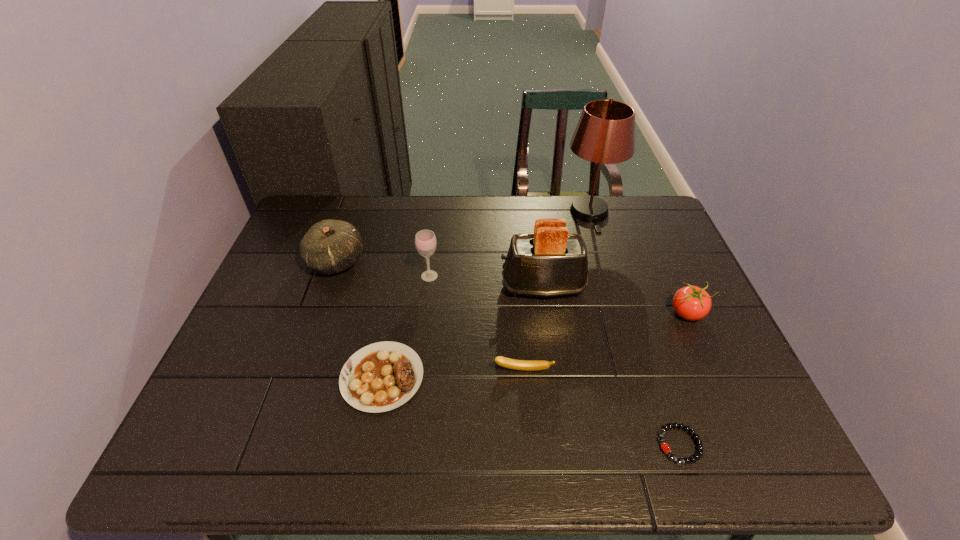
Identify the location of bracelet. (665, 447).

Find the location of `free region located on the front-facing side of the lampshade`. free region located on the front-facing side of the lampshade is located at coordinates (617, 306).

The image size is (960, 540). Find the location of `free space located on the side of the toaster with the control lever`. free space located on the side of the toaster with the control lever is located at coordinates (449, 287).

Locate an element on the screen. Image resolution: width=960 pixels, height=540 pixels. free location located 0.130m on the side of the toaster with the control lever is located at coordinates (452, 287).

The width and height of the screenshot is (960, 540). I want to click on vacant area situated on the side of the toaster with the control lever, so click(x=456, y=287).

Locate an element on the screen. This screenshot has width=960, height=540. free location located on the front of the wineglass is located at coordinates (421, 340).

This screenshot has height=540, width=960. Find the location of `vacant space situated on the front of the leftmost object`. vacant space situated on the front of the leftmost object is located at coordinates (316, 319).

What are the coordinates of `vacant region located on the front of the tomato` in the screenshot? It's located at (702, 346).

Identify the location of vacant space positioned at the stem of the third shortest object. The width and height of the screenshot is (960, 540). (531, 463).

Where is `vacant area situated on the right of the steak`? vacant area situated on the right of the steak is located at coordinates tap(577, 377).